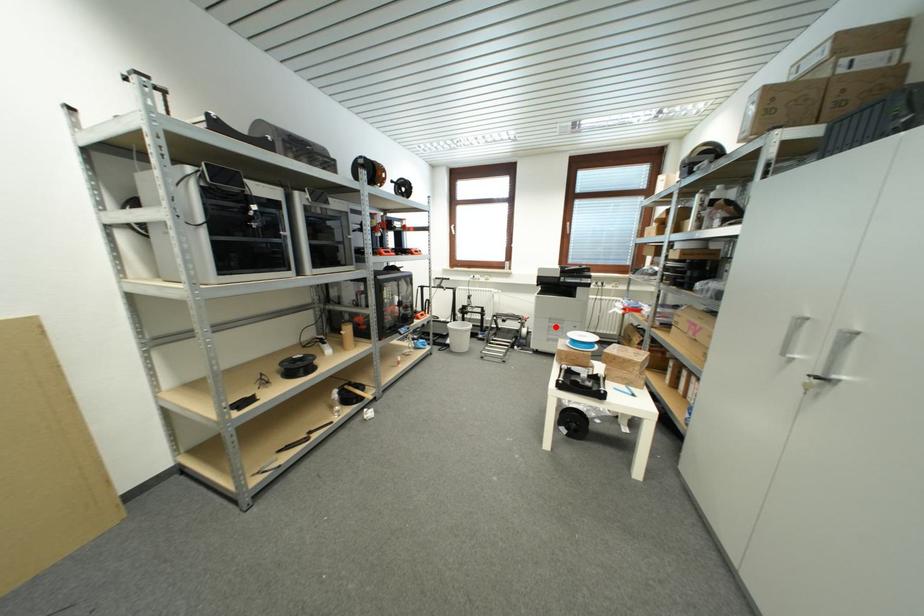
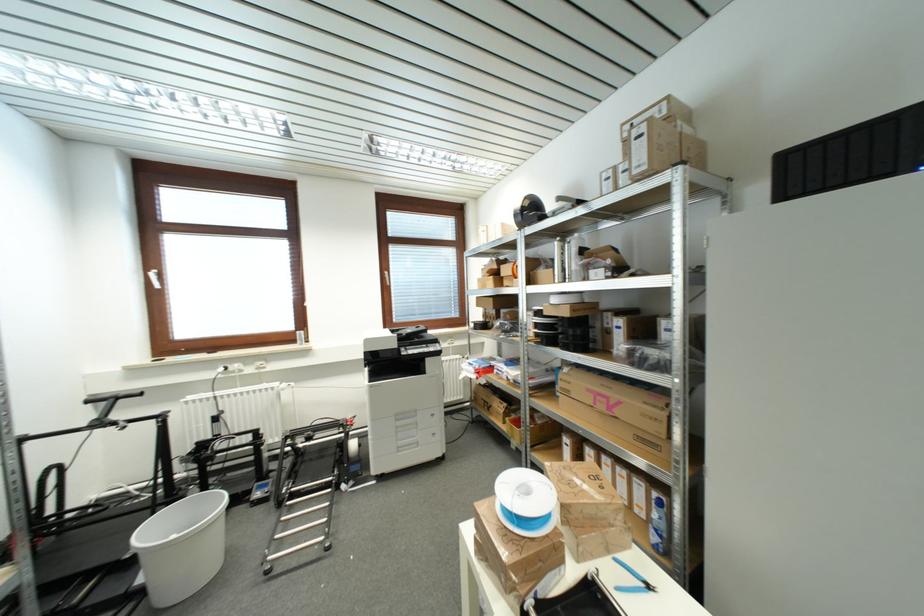
Where in the second image is the point corresponding to the highlighted location from the first image?

(404, 426)